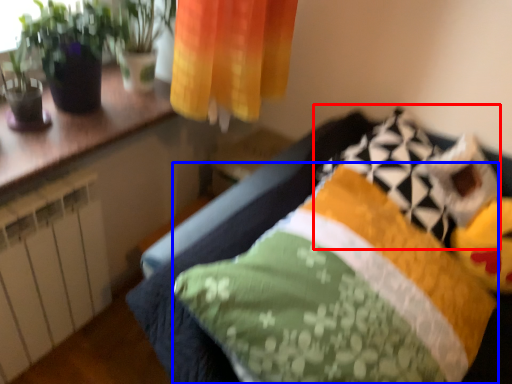
Question: Which object appears farthest to the camera in this image, pillow (highlighted by a red box) or pillow (highlighted by a blue box)?

Choices:
 (A) pillow
 (B) pillow

Answer: (A)